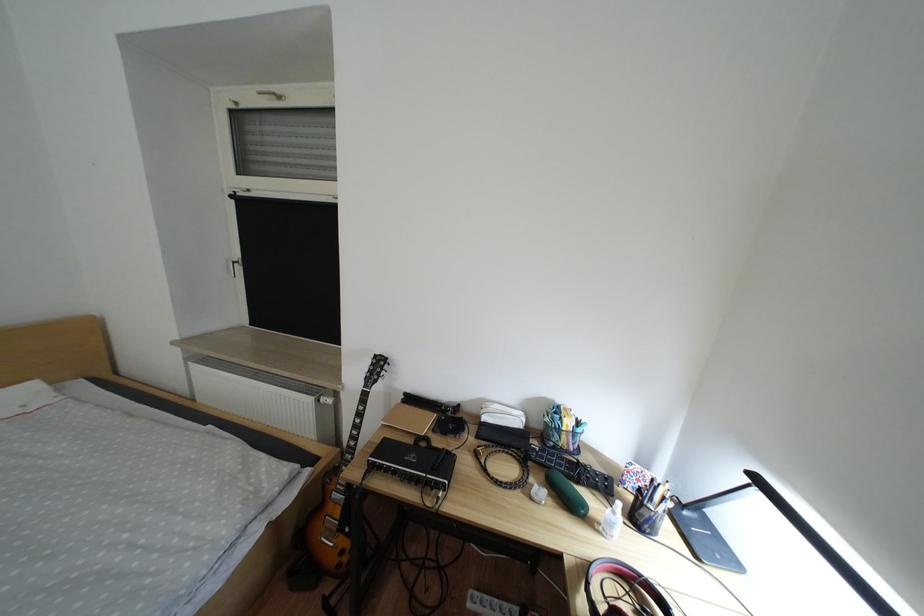
The location [622,591] corresponds to which object?

This point indicates the red and black headphones.